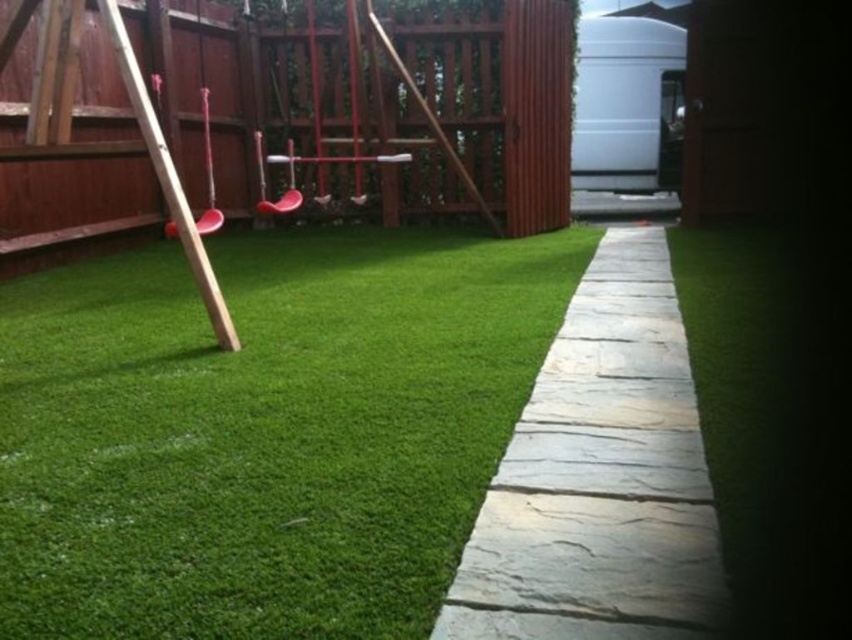
In the scene shown: You are standing in the backyard looking at the swing set and the pathway. There are two points marked in the image. One is at coordinate point (439,586) and the other is at point (330,189). Which point is closer to you?

Point (439,586) is closer to the camera than point (330,189).

You are planning to install a new fence along the wooden fence at upper left and want to ensure it matches the existing one in width. The gray stone path at center is currently 1 meter wide. What should be the minimum width of your new fence in meters?

The wooden fence at upper left is wider than the gray stone path at center. Since the path is 1 meter wide, the fence must be wider than 1 meter. Therefore, the minimum width for the new fence should be greater than 1 meter to match the existing fence.